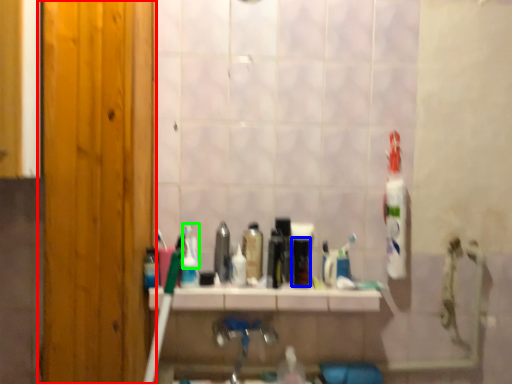
Question: Estimate the real-world distances between objects in this image. Which object is farther from door (highlighted by a red box), mouthwash (highlighted by a blue box) or toothpaste (highlighted by a green box)?

Choices:
 (A) mouthwash
 (B) toothpaste

Answer: (A)